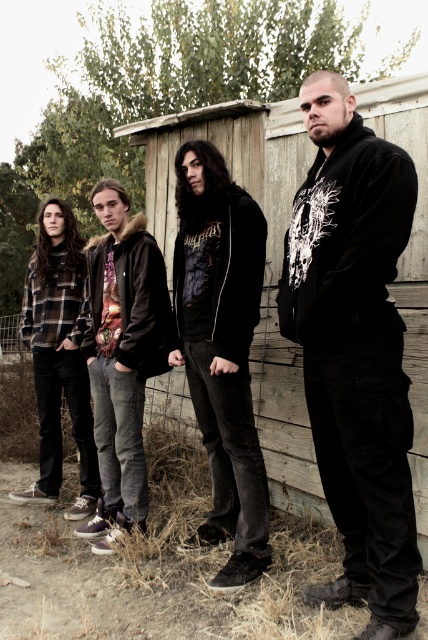
You are a photographer setting up a camera to capture the two hoodies in the scene. The camera has a focal length of 50mm and is positioned 2 meters away from the black velvety hoodie at center. Can you determine if the dark gray hoodie at center will be fully visible in the frame without moving the camera?

The black velvety hoodie at center is 60.64 centimeters from the dark gray hoodie at center. Since the camera is positioned 2 meters away from the black velvety hoodie at center, the dark gray hoodie at center would be within the camera frame as 60.64 cm is a relatively short distance at that range.

You are a photographer trying to capture two hoodies in the scene. You notice the black velvety hoodie at center and the dark gray hoodie at center. Which one is positioned to the right of the other?

The black velvety hoodie at center is positioned to the right of the dark gray hoodie at center.

Based on the photo, you are a photographer trying to capture a group photo of the four individuals. You notice two hoodies at the center of the group. Which of the two hoodies, the black velvety hoodie at center or the dark gray hoodie at center, should you focus on to ensure it appears larger in the photo?

The black velvety hoodie at center is taller than the dark gray hoodie at center, so focusing on it will make it appear larger in the photo.